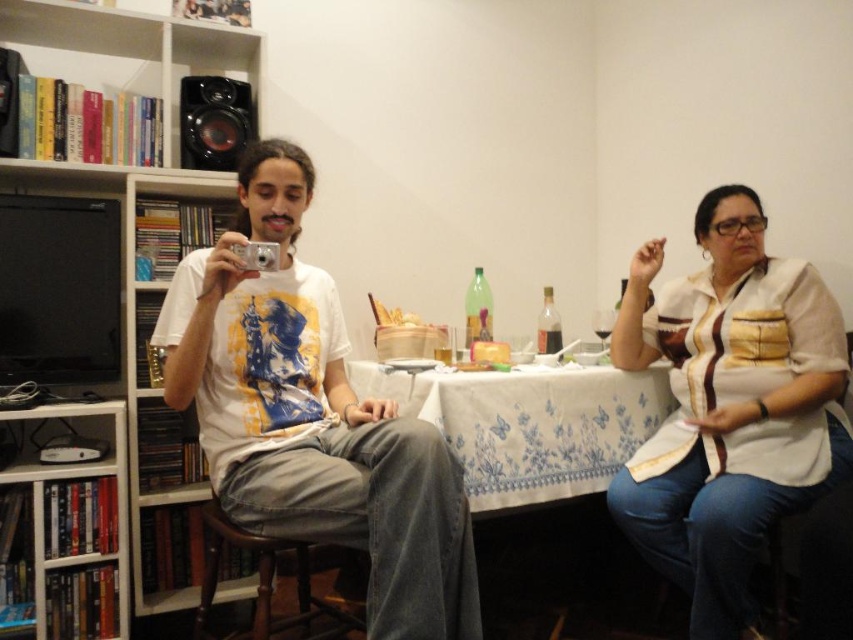
You are a guest at a dinner party and want to place your coat on the chair next to the white textured blouse at right. However, you notice the white wood bookcase at left is nearby. Considering their heights, which item is shorter and thus safer to place your coat on without it touching the ceiling?

The white textured blouse at right has a lesser height compared to the white wood bookcase at left, so placing your coat on the chair next to the white textured blouse at right would be safer as it is shorter and less likely to touch the ceiling.

In the scene shown: You are a guest at a dinner party and notice the white textured blouse at right and the white wood bookcase at left. Which object is closer to the right edge of the room?

The white textured blouse at right is closer to the right edge of the room because it is positioned on the right side of the white wood bookcase at left.